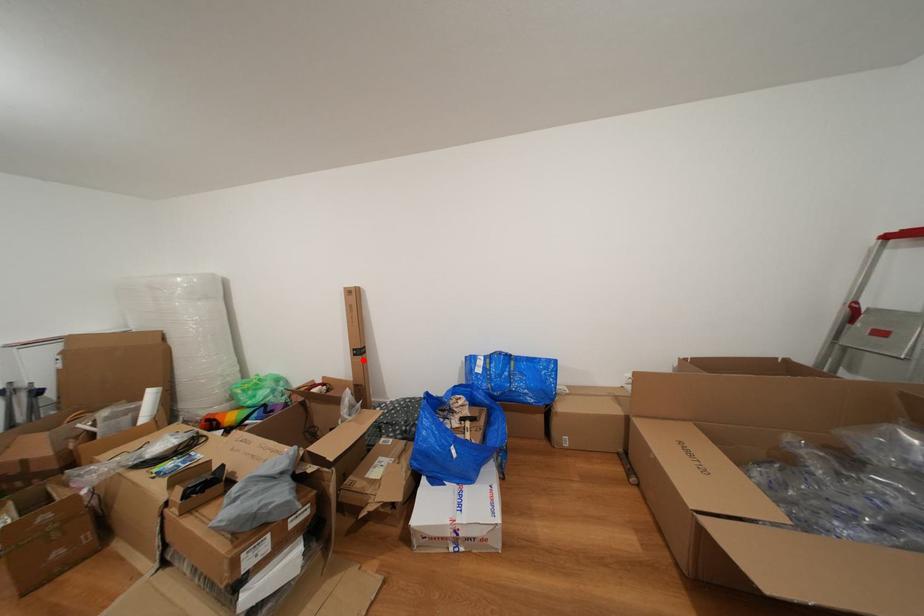
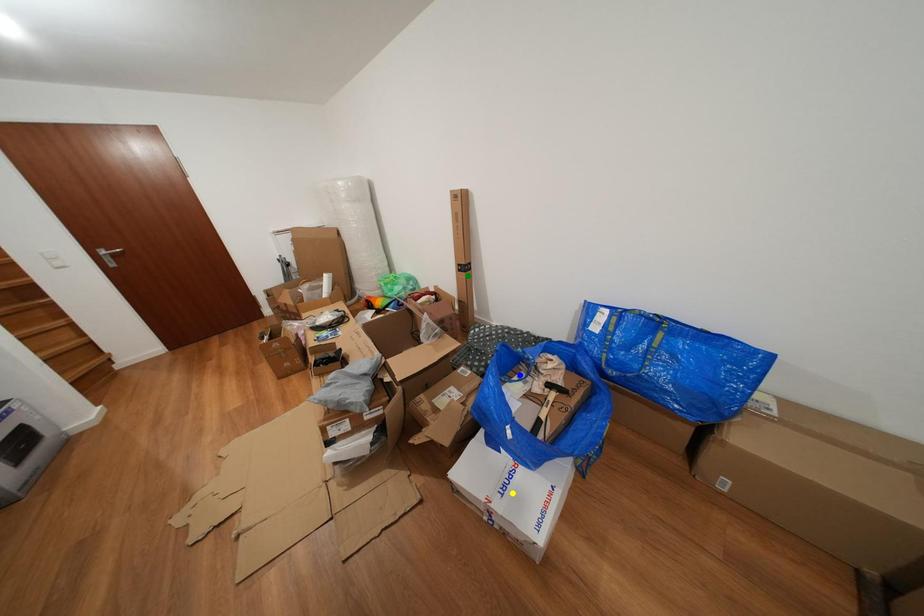
Question: I am providing you with two images of the same scene from different viewpoints. A red point is marked on the first image. You are given multiple points on the second image. Which point in image 2 represents the same 3d spot as the red point in image 1?

Choices:
 (A) blue point
 (B) green point
 (C) yellow point

Answer: (B)